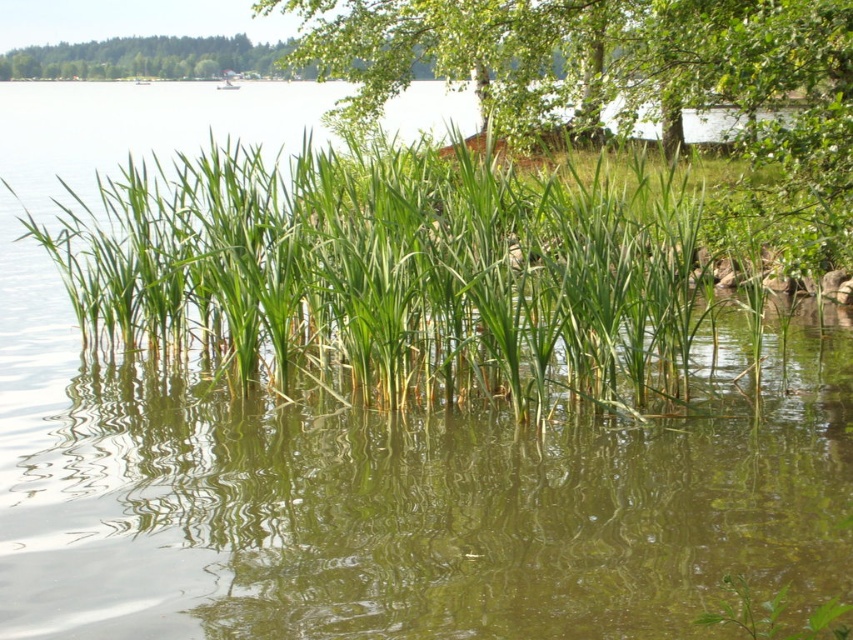
You are standing at the lakeside and want to take a photo of the green grassy reed at center and the green leafy tree at upper center. Which object should you adjust your camera to focus on first if you want both in the frame?

You should focus on the green leafy tree at upper center first because it is to the left of the green grassy reed at center, so adjusting the camera to include it first will help capture both objects in the frame.

You are an environmental scientist observing the lakeside. You need to determine which of the two objects, the green grassy reed at center or the green leafy tree at upper center, has a smaller diameter. Which one is it?

The green grassy reed at center is thinner than the green leafy tree at upper center, so the green grassy reed at center has a smaller diameter.